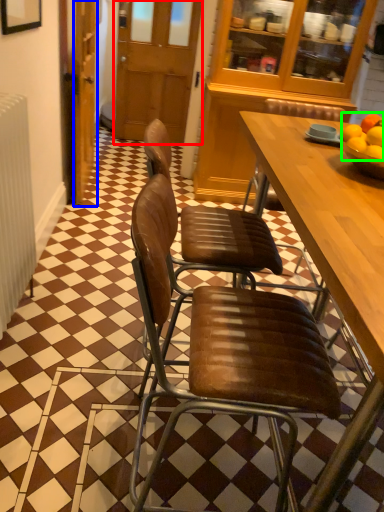
Question: Which object is positioned farthest from glass door (highlighted by a red box)? Select from door (highlighted by a blue box) and fruit (highlighted by a green box).

Choices:
 (A) door
 (B) fruit

Answer: (B)